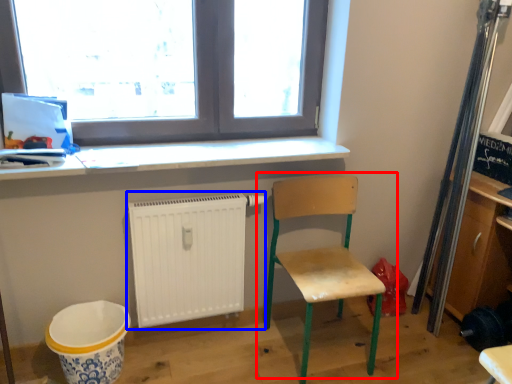
Question: Among these objects, which one is nearest to the camera, chair (highlighted by a red box) or radiator (highlighted by a blue box)?

Choices:
 (A) chair
 (B) radiator

Answer: (A)